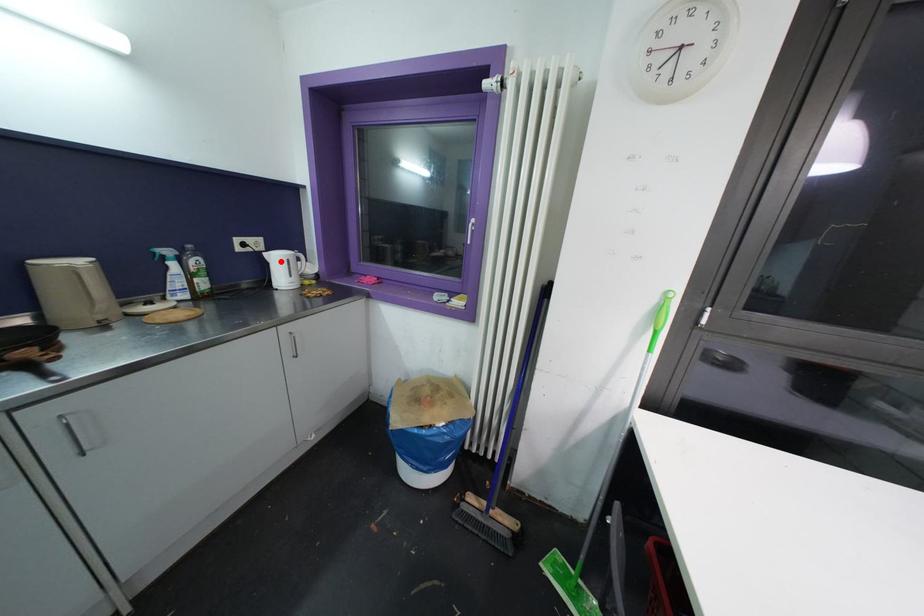
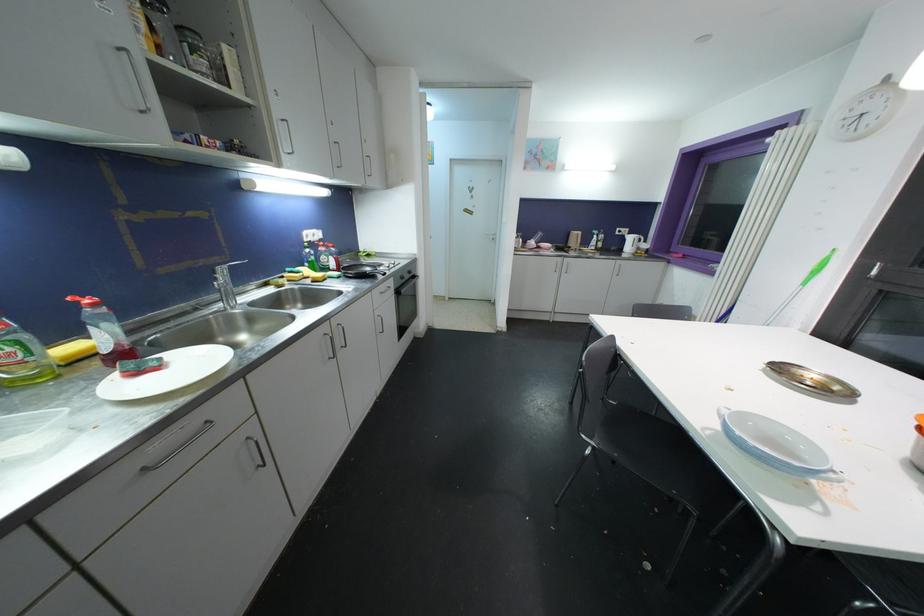
Question: I am providing you with two images of the same scene from different viewpoints. Given a red point in image1, look at the same physical point in image2. Is it:

Choices:
 (A) Closer to the viewpoint
 (B) Farther from the viewpoint

Answer: (A)